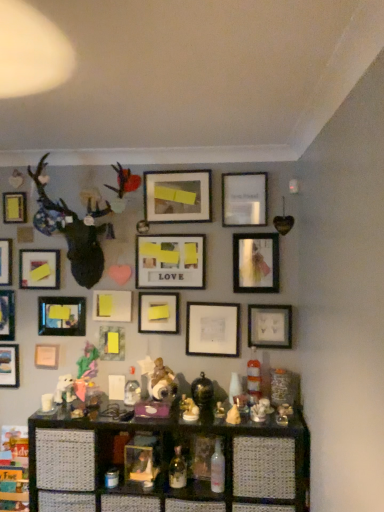
Question: From the image's perspective, is matte white picture frame at lower left, the tenth picture frame from the right, located above shiny gold figurine at center, positioned as the 3th toy in right-to-left order?

Choices:
 (A) no
 (B) yes

Answer: (B)

Question: Is matte white picture frame at lower left, the tenth picture frame from the right, looking in the opposite direction of shiny gold figurine at center, positioned as the 3th toy in right-to-left order?

Choices:
 (A) no
 (B) yes

Answer: (A)

Question: Does matte white picture frame at lower left, the tenth picture frame from the right, have a larger size compared to shiny gold figurine at center, positioned as the 3th toy in right-to-left order?

Choices:
 (A) yes
 (B) no

Answer: (B)

Question: Can shiny gold figurine at center, marked as the second toy in a left-to-right arrangement, be found inside matte white picture frame at lower left, the tenth picture frame from the right?

Choices:
 (A) yes
 (B) no

Answer: (B)

Question: Does matte white picture frame at lower left, the tenth picture frame from the right, have a smaller size compared to shiny gold figurine at center, positioned as the 3th toy in right-to-left order?

Choices:
 (A) no
 (B) yes

Answer: (B)

Question: Does matte white picture frame at lower left, positioned as the 6th picture frame in left-to-right order, appear on the left side of shiny gold figurine at center, marked as the second toy in a left-to-right arrangement?

Choices:
 (A) no
 (B) yes

Answer: (B)

Question: Considering the relative positions of shiny gold figurine at center, marked as the second toy in a left-to-right arrangement, and matte black picture frame at lower left, placed as the 7th picture frame when sorted from left to right, in the image provided, is shiny gold figurine at center, marked as the second toy in a left-to-right arrangement, to the left of matte black picture frame at lower left, placed as the 7th picture frame when sorted from left to right, from the viewer's perspective?

Choices:
 (A) no
 (B) yes

Answer: (A)

Question: Would you say shiny gold figurine at center, marked as the second toy in a left-to-right arrangement, is outside matte black picture frame at lower left, placed as the 7th picture frame when sorted from left to right?

Choices:
 (A) no
 (B) yes

Answer: (B)

Question: Can you confirm if shiny gold figurine at center, marked as the second toy in a left-to-right arrangement, is positioned to the right of matte black picture frame at lower left, placed as the 7th picture frame when sorted from left to right?

Choices:
 (A) no
 (B) yes

Answer: (B)

Question: Could you tell me if shiny gold figurine at center, marked as the second toy in a left-to-right arrangement, is facing matte black picture frame at lower left, the ninth picture frame from the right?

Choices:
 (A) yes
 (B) no

Answer: (B)

Question: Does shiny gold figurine at center, marked as the second toy in a left-to-right arrangement, lie behind matte black picture frame at lower left, placed as the 7th picture frame when sorted from left to right?

Choices:
 (A) yes
 (B) no

Answer: (B)

Question: Does shiny gold figurine at center, positioned as the 3th toy in right-to-left order, have a greater height compared to matte black picture frame at lower left, the ninth picture frame from the right?

Choices:
 (A) yes
 (B) no

Answer: (B)

Question: Is matte white picture frame at center, marked as the sixth picture frame in a right-to-left arrangement, touching white porcelain figurine at center, marked as the 3th toy in a left-to-right arrangement?

Choices:
 (A) yes
 (B) no

Answer: (B)